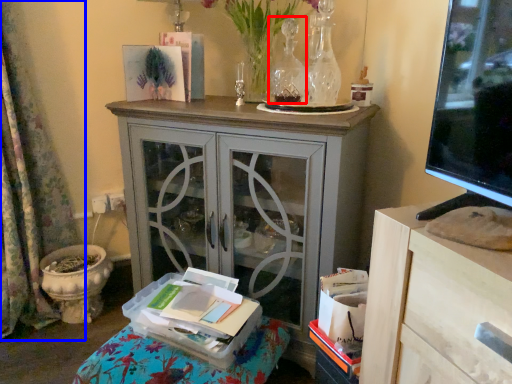
Question: Among these objects, which one is farthest to the camera, vase (highlighted by a red box) or curtain (highlighted by a blue box)?

Choices:
 (A) vase
 (B) curtain

Answer: (A)